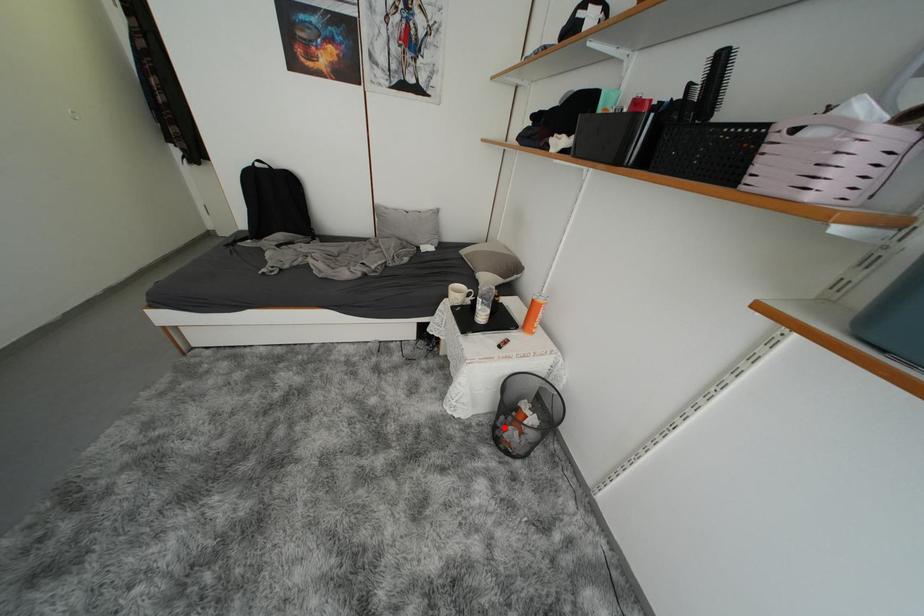
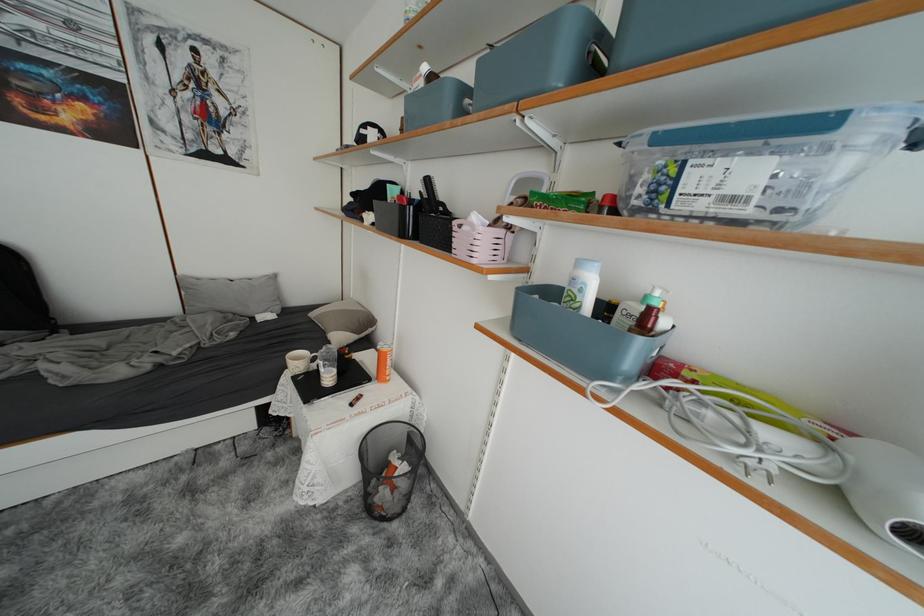
Find the pixel in the second image that matches the highlighted location in the first image.

(375, 493)